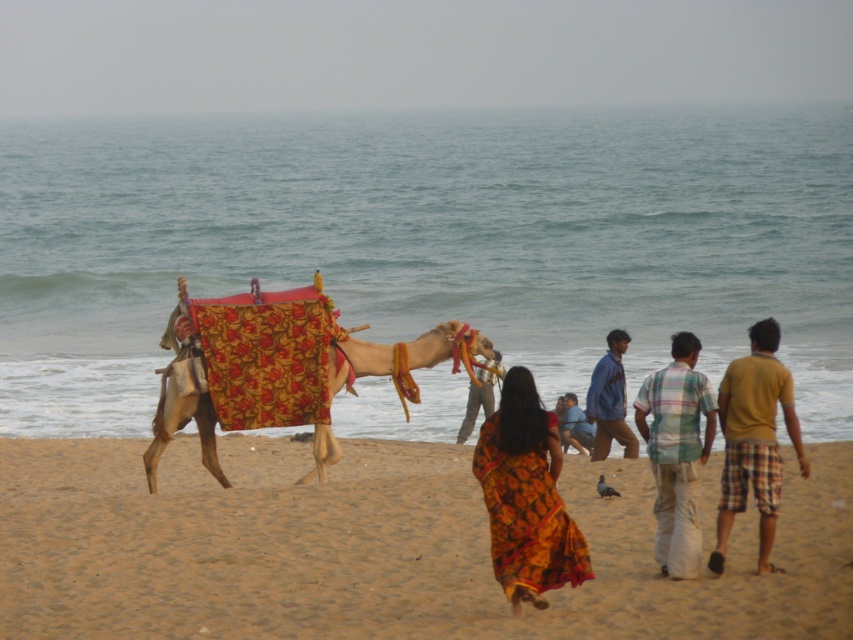
You are a photographer at the beach scene. You need to take a photo that includes both the plaid cotton shirt at center right and the blue plaid shirt at center. Which shirt should you position to the left in your camera frame to include both?

The plaid cotton shirt at center right is already positioned on the left side of the blue plaid shirt at center, so to include both in the photo, you should ensure the plaid cotton shirt at center right remains on the left side in the frame.

You are a photographer standing at the edge of the beach, wanting to capture a photo of both the floral fabric camel at center and the blue denim shirt at center in the same frame. The camera you are using has a maximum focus range of 8 feet. Will both subjects be in focus if you position yourself exactly between them?

The floral fabric camel at center is 8.23 feet from the blue denim shirt at center. Since the camera can only focus up to 8 feet, positioning yourself exactly between them would mean each subject is about 4.115 feet away from you. This distance is within the camera focus range of 8 feet, so both subjects will be in focus.